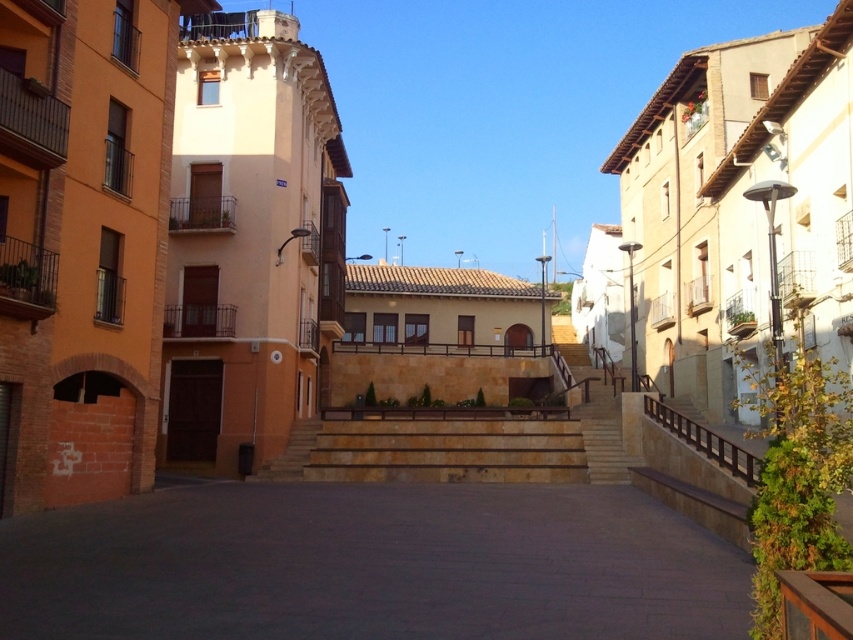
Which is behind, point (335, 454) or point (660, 412)?

Point (335, 454)

Between natural stone stairs at center and brown wooden rail at right, which one appears on the right side from the viewer's perspective?

From the viewer's perspective, brown wooden rail at right appears more on the right side.

Between point (479, 472) and point (717, 444), which one is positioned behind?

Point (479, 472)

This screenshot has height=640, width=853. In order to click on natural stone stairs at center in this screenshot , I will do `click(433, 449)`.

Is dark gray concrete alley at center smaller than beige stone stairs at center?

Yes.

Is point (656, 620) farther from viewer compared to point (604, 481)?

No, (656, 620) is in front of (604, 481).

This screenshot has height=640, width=853. I want to click on dark gray concrete alley at center, so click(x=370, y=564).

Where is `dark gray concrete alley at center`? The height and width of the screenshot is (640, 853). dark gray concrete alley at center is located at coordinates (370, 564).

Where is `dark gray concrete alley at center`? The width and height of the screenshot is (853, 640). dark gray concrete alley at center is located at coordinates (370, 564).